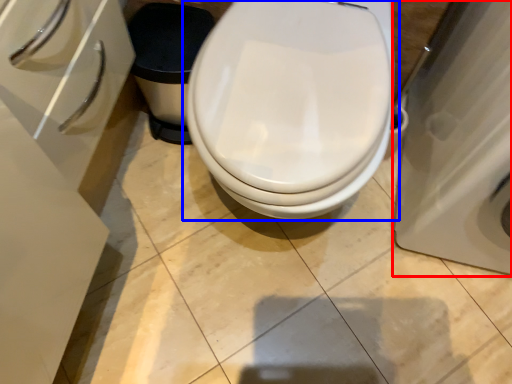
Question: Among these objects, which one is farthest to the camera, porcelain (highlighted by a red box) or toilet (highlighted by a blue box)?

Choices:
 (A) porcelain
 (B) toilet

Answer: (B)